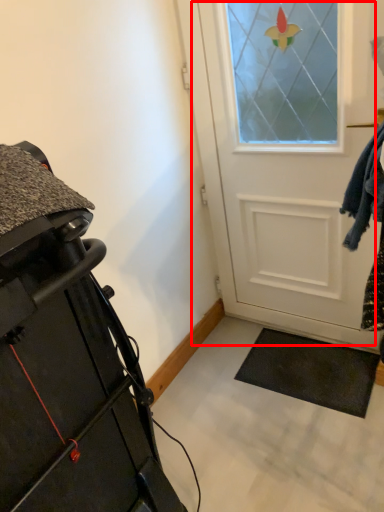
Question: Observing the image, what is the correct spatial positioning of door (annotated by the red box) in reference to furniture?

Choices:
 (A) right
 (B) left

Answer: (A)